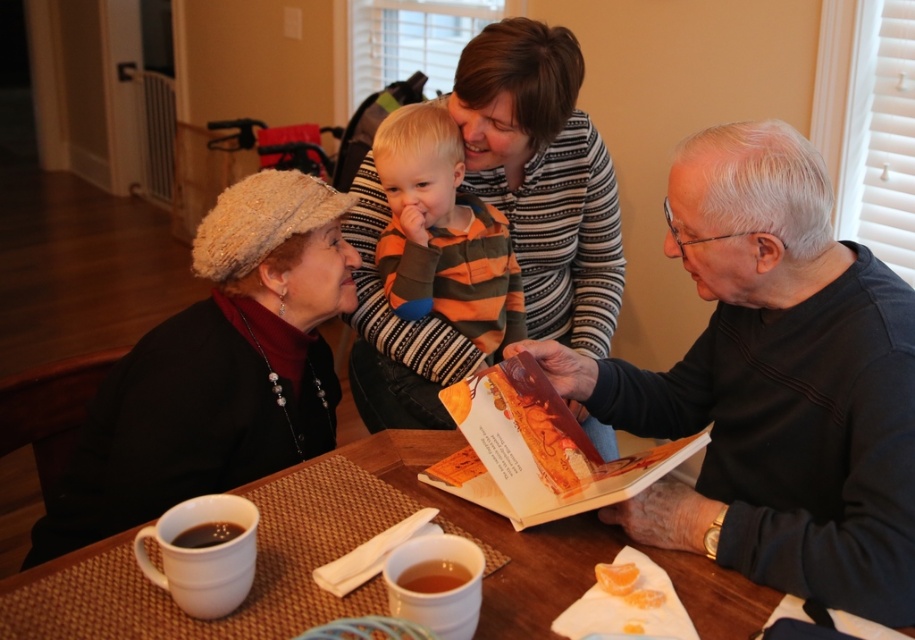
Question: Which point is closer to the camera?

Choices:
 (A) (700, 365)
 (B) (429, 572)
 (C) (407, 449)

Answer: (B)

Question: In this image, where is black matte book at center located relative to orange paper book at center?

Choices:
 (A) left
 (B) right

Answer: (B)

Question: Is black matte book at center positioned at the back of brown woven table at center?

Choices:
 (A) yes
 (B) no

Answer: (A)

Question: Which of these objects is positioned closest to the matte black jacket at lower left?

Choices:
 (A) black matte book at center
 (B) orange striped sweater at center
 (C) striped sweater at upper center
 (D) orange paper book at center

Answer: (B)

Question: Is striped sweater at upper center smaller than orange paper book at center?

Choices:
 (A) no
 (B) yes

Answer: (A)

Question: Which of the following is the closest to the observer?

Choices:
 (A) translucent glass cup of amber liquid at lower center
 (B) black matte mug at lower left
 (C) brown woven table at center

Answer: (C)